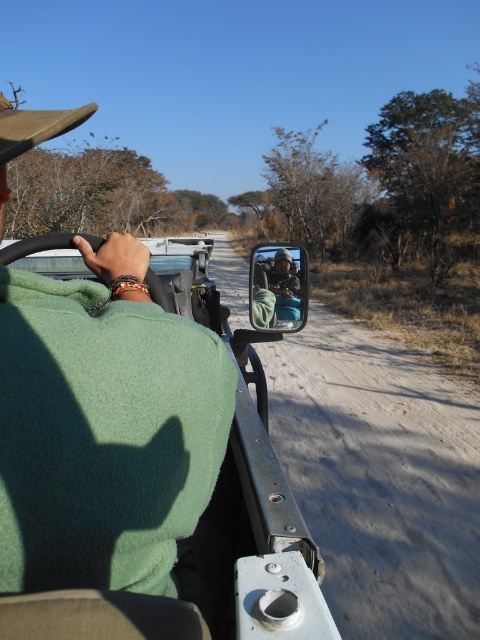
Question: Does metallic side mirror at center appear under matte black jacket at center?

Choices:
 (A) no
 (B) yes

Answer: (B)

Question: Is metallic side mirror at center bigger than brown felt cowboy hat at upper left?

Choices:
 (A) yes
 (B) no

Answer: (B)

Question: Is metallic side mirror at center to the left of matte black jacket at center from the viewer's perspective?

Choices:
 (A) yes
 (B) no

Answer: (A)

Question: Based on their relative distances, which object is farther from the matte black jacket at center?

Choices:
 (A) metallic side mirror at center
 (B) brown felt cowboy hat at upper left

Answer: (B)

Question: Among these objects, which one is nearest to the camera?

Choices:
 (A) matte black jacket at center
 (B) brown felt cowboy hat at upper left
 (C) metallic side mirror at center

Answer: (C)

Question: Estimate the real-world distances between objects in this image. Which object is closer to the matte black jacket at center?

Choices:
 (A) brown felt cowboy hat at upper left
 (B) metallic side mirror at center

Answer: (B)